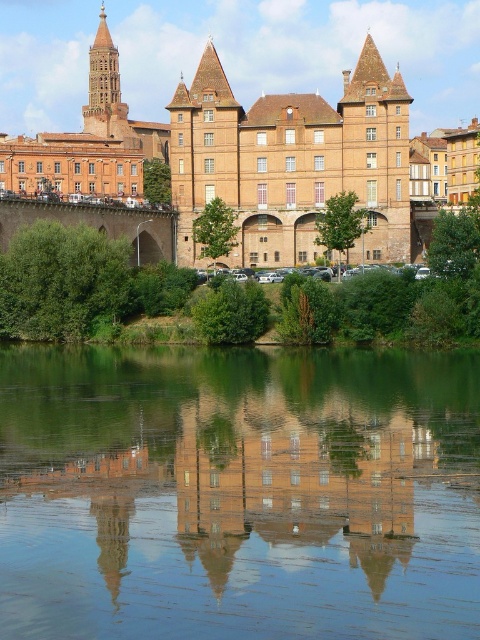
Which is below, green reflective water at center or matte brick building at center?

green reflective water at center is lower down.

Looking at this image, is green reflective water at center smaller than matte brick building at center?

Actually, green reflective water at center might be larger than matte brick building at center.

Between point (430, 394) and point (384, 96), which one is positioned in front?

Point (430, 394)

Image resolution: width=480 pixels, height=640 pixels. In order to click on green reflective water at center in this screenshot , I will do `click(239, 493)`.

Where is `green reflective water at center`? green reflective water at center is located at coordinates (239, 493).

Does green reflective water at center come behind brown brick building at center?

No.

This screenshot has height=640, width=480. Find the location of `green reflective water at center`. green reflective water at center is located at coordinates click(239, 493).

Does brown brick building at center appear on the right side of matte brick building at center?

Yes, brown brick building at center is to the right of matte brick building at center.

Is brown brick building at center further to the viewer compared to matte brick building at center?

Yes, it is behind matte brick building at center.

Is point (32, 44) less distant than point (213, 49)?

No, (32, 44) is further to viewer.

Where is `brown brick building at center`? The height and width of the screenshot is (640, 480). brown brick building at center is located at coordinates (312, 122).